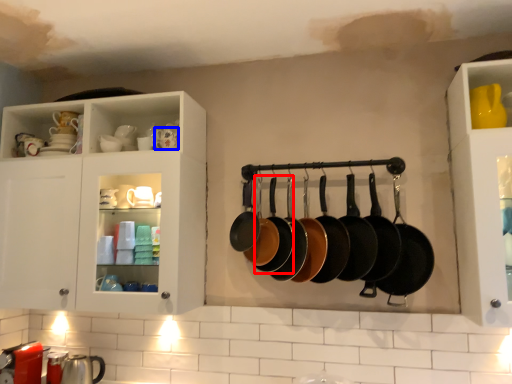
Question: Which object is further to the camera taking this photo, frying pan (highlighted by a red box) or tableware (highlighted by a blue box)?

Choices:
 (A) frying pan
 (B) tableware

Answer: (B)